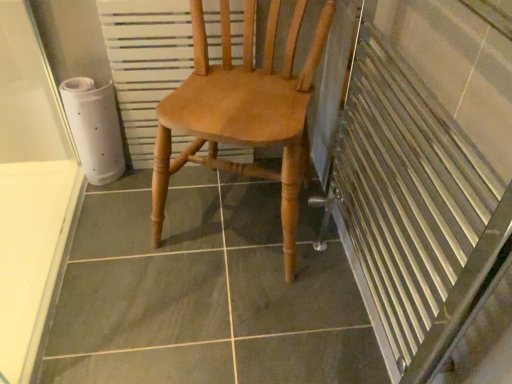
Question: From the image's perspective, does white textured radiator at center appear higher than light brown wood chair at center?

Choices:
 (A) no
 (B) yes

Answer: (B)

Question: Is white textured radiator at center turned away from light brown wood chair at center?

Choices:
 (A) no
 (B) yes

Answer: (A)

Question: Can you confirm if white textured radiator at center is positioned to the left of light brown wood chair at center?

Choices:
 (A) yes
 (B) no

Answer: (A)

Question: Does white textured radiator at center have a greater width compared to light brown wood chair at center?

Choices:
 (A) no
 (B) yes

Answer: (A)

Question: Considering the relative sizes of white textured radiator at center and light brown wood chair at center in the image provided, is white textured radiator at center shorter than light brown wood chair at center?

Choices:
 (A) no
 (B) yes

Answer: (B)

Question: Considering the relative sizes of white textured radiator at center and light brown wood chair at center in the image provided, is white textured radiator at center taller than light brown wood chair at center?

Choices:
 (A) no
 (B) yes

Answer: (A)

Question: Is white textured radiator at center at the back of light brown wood chair at center?

Choices:
 (A) no
 (B) yes

Answer: (A)

Question: Are light brown wood chair at center and white textured radiator at center far apart?

Choices:
 (A) yes
 (B) no

Answer: (B)

Question: Is light brown wood chair at center further to the viewer compared to white textured radiator at center?

Choices:
 (A) yes
 (B) no

Answer: (B)

Question: From the image's perspective, does light brown wood chair at center appear higher than white textured radiator at center?

Choices:
 (A) no
 (B) yes

Answer: (A)

Question: Is white textured radiator at center inside light brown wood chair at center?

Choices:
 (A) no
 (B) yes

Answer: (B)

Question: From a real-world perspective, is light brown wood chair at center on white textured radiator at center?

Choices:
 (A) yes
 (B) no

Answer: (A)

Question: Relative to light brown wood chair at center, is white textured radiator at center in front or behind?

Choices:
 (A) behind
 (B) front

Answer: (A)